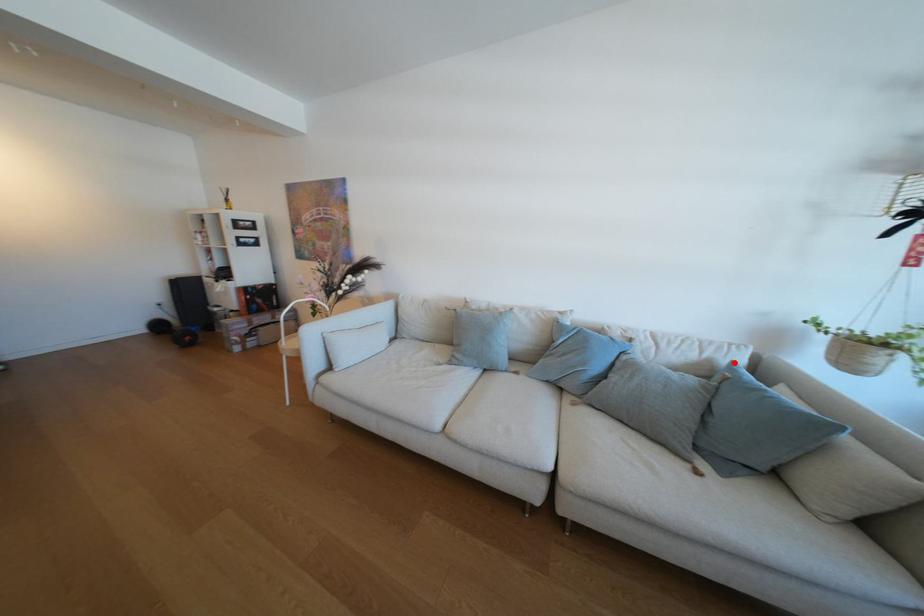
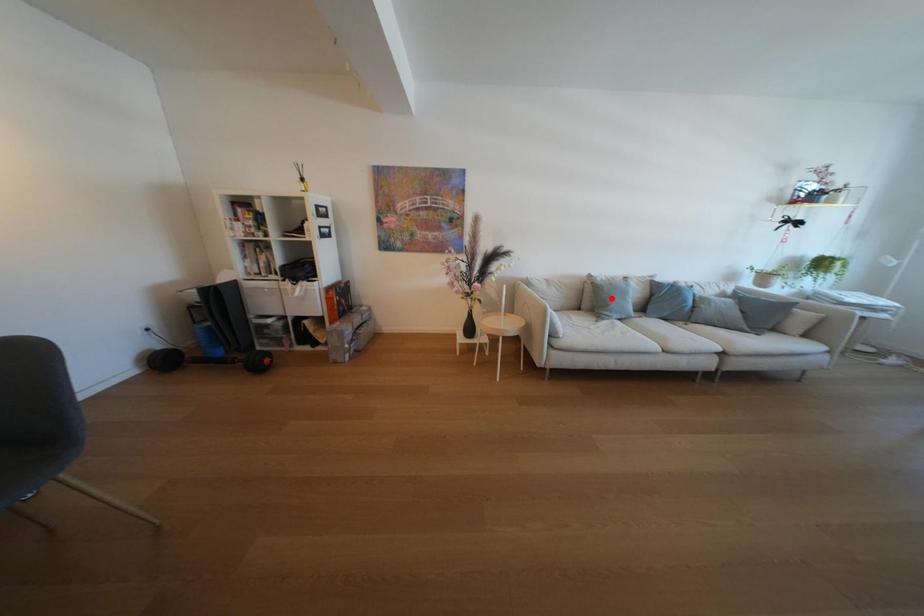
I am providing you with two images of the same scene from different viewpoints. A red point is marked on the first image and another point is marked on the second image. Is the marked point in image1 the same physical position as the marked point in image2?

No